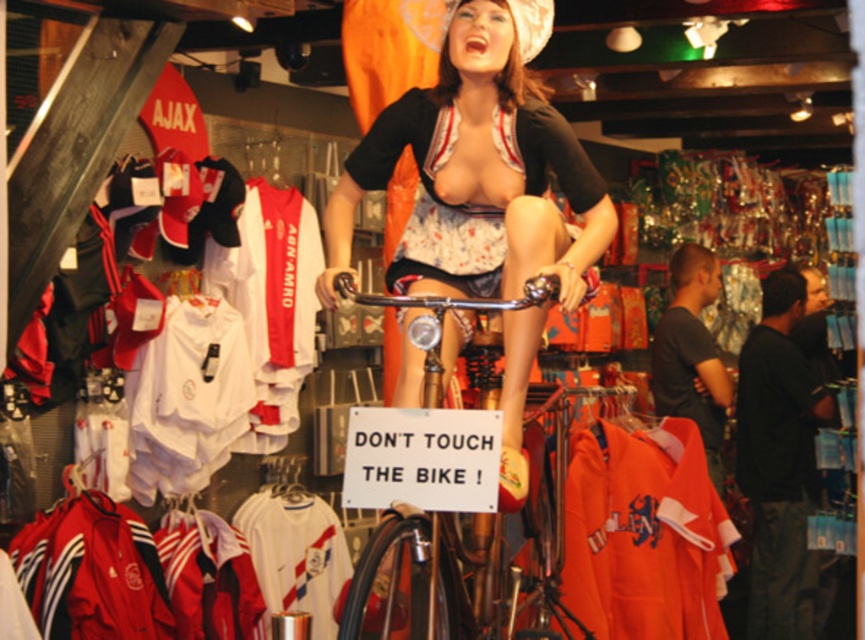
Does orange fabric hoodie at center appear on the left side of shiny chrome bicycle at center?

No, orange fabric hoodie at center is not to the left of shiny chrome bicycle at center.

This screenshot has width=865, height=640. In order to click on orange fabric hoodie at center in this screenshot , I will do `click(644, 534)`.

Is point (568, 540) positioned after point (434, 346)?

Yes, point (568, 540) is behind point (434, 346).

Where is `orange fabric hoodie at center`? orange fabric hoodie at center is located at coordinates (644, 534).

From the picture: Does matte black bicycle at center have a greater width compared to black matte bandeau at right?

Indeed, matte black bicycle at center has a greater width compared to black matte bandeau at right.

Who is lower down, matte black bicycle at center or black matte bandeau at right?

Positioned lower is black matte bandeau at right.

Locate an element on the screen. The width and height of the screenshot is (865, 640). matte black bicycle at center is located at coordinates (479, 170).

Does black matte bandeau at right appear on the left side of shiny chrome bicycle at center?

Incorrect, black matte bandeau at right is not on the left side of shiny chrome bicycle at center.

Who is more distant from viewer, [791,275] or [542,280]?

Point [791,275]

Where is `black matte bandeau at right`? Image resolution: width=865 pixels, height=640 pixels. black matte bandeau at right is located at coordinates (779, 461).